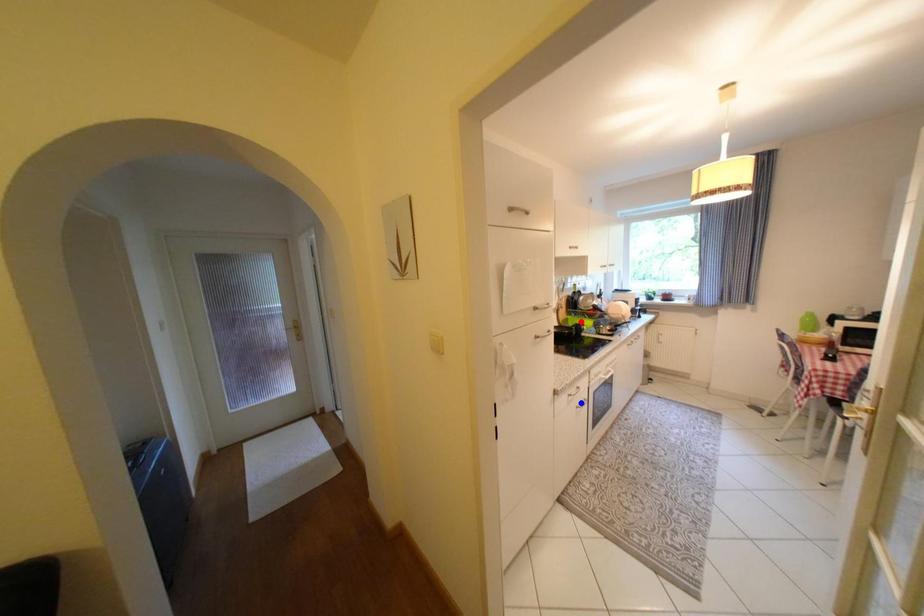
Question: Two points are marked on the image. Which point is closer to the camera?

Choices:
 (A) Blue point is closer.
 (B) Red point is closer.

Answer: (A)